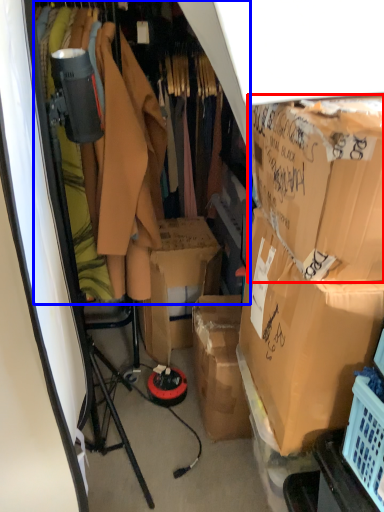
Question: Which point is closer to the camera, box (highlighted by a red box) or closet (highlighted by a blue box)?

Choices:
 (A) box
 (B) closet

Answer: (A)